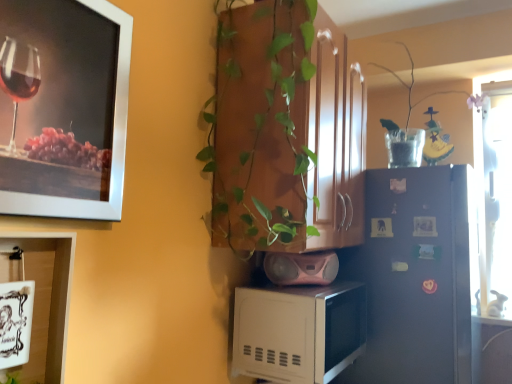
In order to click on vacant area that is in front of pink plastic speaker at lower center in this screenshot , I will do `click(305, 292)`.